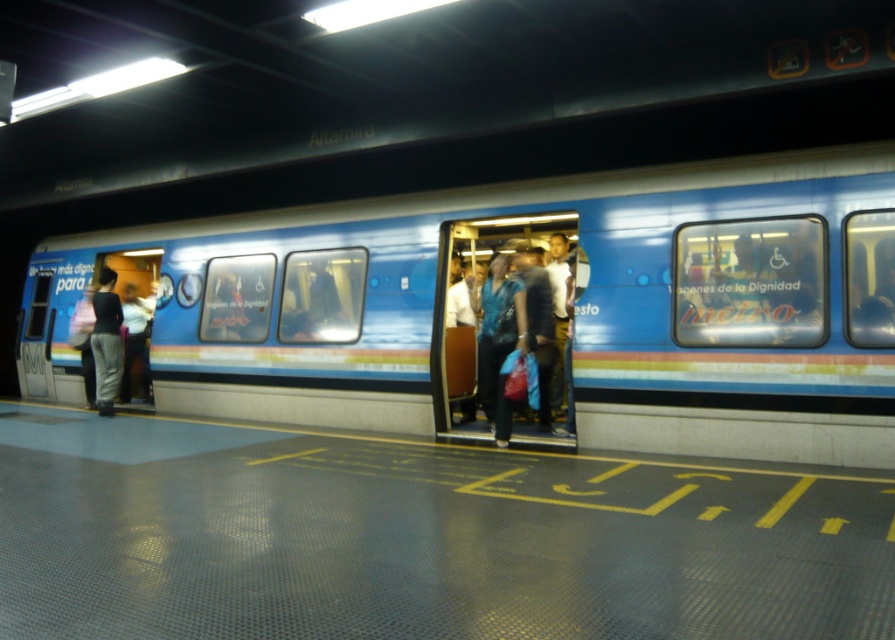
You are a passenger on the subway platform at Altamira station and notice a blue fabric bag at center. Where exactly is the blue fabric bag located in relation to the train doors?

The blue fabric bag at center is located at point (501, 321), which is near the train doors since it is at the center of the platform where the doors are open.

You are standing on the subway platform at Altamira station and want to board the blue glossy train at center. Considering the train doors are open, where should you position yourself relative to the train to board safely?

The blue glossy train at center is located at point coordinates, so you should position yourself near the open doors of the train to board safely.

You are a passenger waiting at the Altamira subway station platform. You see a blue glossy train at center and a blue fabric bag at center. Which object is closer to the platform edge?

The blue glossy train at center is positioned on the left side of blue fabric bag at center. Since the platform edge is typically on the right side of the train, the blue fabric bag at center is closer to the platform edge.